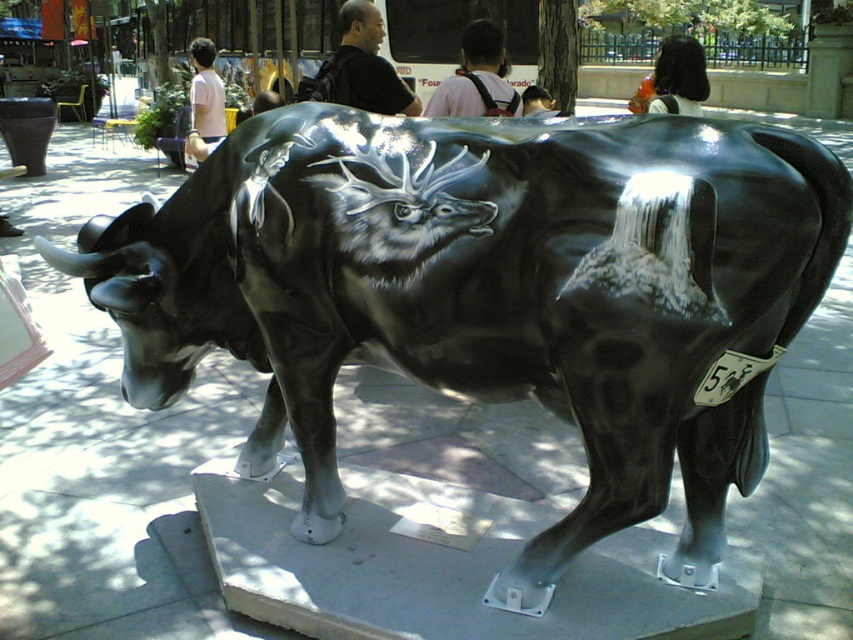
Based on the photo, does black matte shirt at center have a smaller size compared to black shirt at upper center?

Incorrect, black matte shirt at center is not smaller in size than black shirt at upper center.

Is black matte shirt at center bigger than black shirt at upper center?

Yes, black matte shirt at center is bigger than black shirt at upper center.

Image resolution: width=853 pixels, height=640 pixels. What do you see at coordinates (361, 67) in the screenshot?
I see `black matte shirt at center` at bounding box center [361, 67].

Identify the location of black matte shirt at center. (361, 67).

Does black hair at upper center have a larger size compared to pink t-shirt at upper left?

No.

At what (x,y) coordinates should I click in order to perform the action: click on black hair at upper center. Please return your answer as a coordinate pair (x, y). Looking at the image, I should click on (679, 77).

What do you see at coordinates (679, 77) in the screenshot? This screenshot has height=640, width=853. I see `black hair at upper center` at bounding box center [679, 77].

What are the coordinates of `black hair at upper center` in the screenshot? It's located at [x=679, y=77].

Does pink t-shirt at upper left appear on the left side of smooth brown hair at upper center?

Correct, you'll find pink t-shirt at upper left to the left of smooth brown hair at upper center.

At what (x,y) coordinates should I click in order to perform the action: click on pink t-shirt at upper left. Please return your answer as a coordinate pair (x, y). The image size is (853, 640). Looking at the image, I should click on (204, 100).

Image resolution: width=853 pixels, height=640 pixels. What do you see at coordinates (204, 100) in the screenshot?
I see `pink t-shirt at upper left` at bounding box center [204, 100].

Image resolution: width=853 pixels, height=640 pixels. I want to click on pink t-shirt at upper left, so click(204, 100).